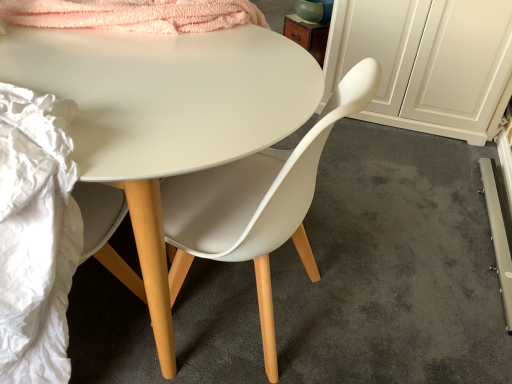
Question: From a real-world perspective, relative to matte white chair at center, is matte white chair at center vertically above or below?

Choices:
 (A) below
 (B) above

Answer: (B)

Question: Based on their sizes in the image, would you say matte white chair at center is bigger or smaller than matte white chair at center?

Choices:
 (A) small
 (B) big

Answer: (A)

Question: Estimate the real-world distances between objects in this image. Which object is farther from the matte white chair at center?

Choices:
 (A) white matte desk at center
 (B) white matte cabinet at right
 (C) matte white chair at center

Answer: (B)

Question: Which object is positioned farthest from the white matte cabinet at right?

Choices:
 (A) matte white chair at center
 (B) matte white chair at center
 (C) white matte desk at center

Answer: (C)